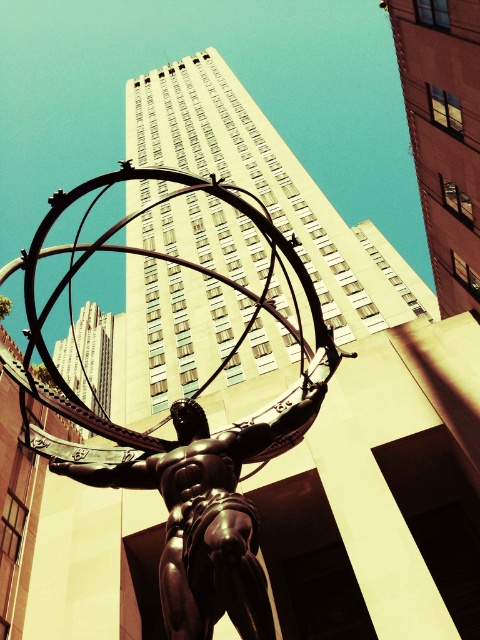
Question: Can you confirm if polished bronze statue at center is positioned below shiny bronze statue at center?

Choices:
 (A) no
 (B) yes

Answer: (A)

Question: Is polished bronze statue at center bigger than shiny bronze statue at center?

Choices:
 (A) yes
 (B) no

Answer: (A)

Question: Among these points, which one is farthest from the camera?

Choices:
 (A) (187, 552)
 (B) (189, 600)

Answer: (A)

Question: Which point is farther to the camera?

Choices:
 (A) shiny bronze statue at center
 (B) polished bronze statue at center

Answer: (B)

Question: Which point appears closest to the camera in this image?

Choices:
 (A) (206, 516)
 (B) (173, 522)

Answer: (A)

Question: Does polished bronze statue at center appear over shiny bronze statue at center?

Choices:
 (A) yes
 (B) no

Answer: (A)